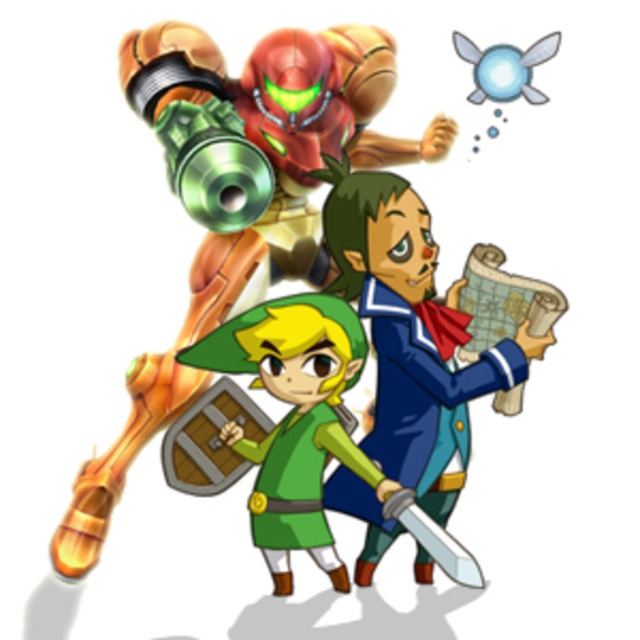
You are standing in front of the image and want to know how far the point at coordinates point (x=156, y=22) is from you. Can you determine the distance?

The point at coordinates point (x=156, y=22) is 10.92 feet away from you.

What is located at the coordinates point (x=237, y=198)?

The metallic gold suit at upper left is located at point (x=237, y=198).

You are standing in front of the image and want to touch both the point at coordinates point (296, 88) and the point at coordinates point (419, 413). Which point would require you to reach further back?

The point at coordinates point (419, 413) is further away from you, so you would need to reach further back to touch it.